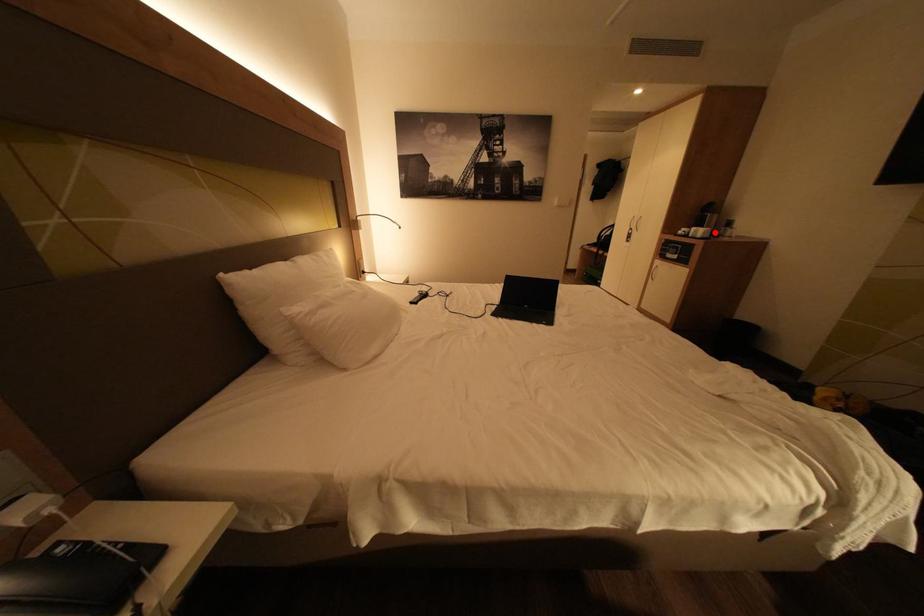
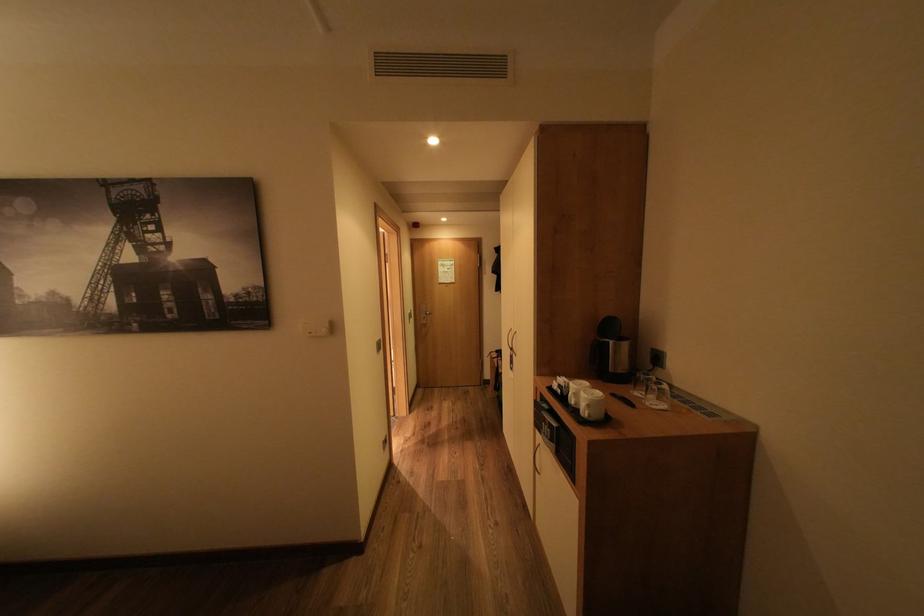
In the second image, find the point that corresponds to the highlighted location in the first image.

(600, 406)